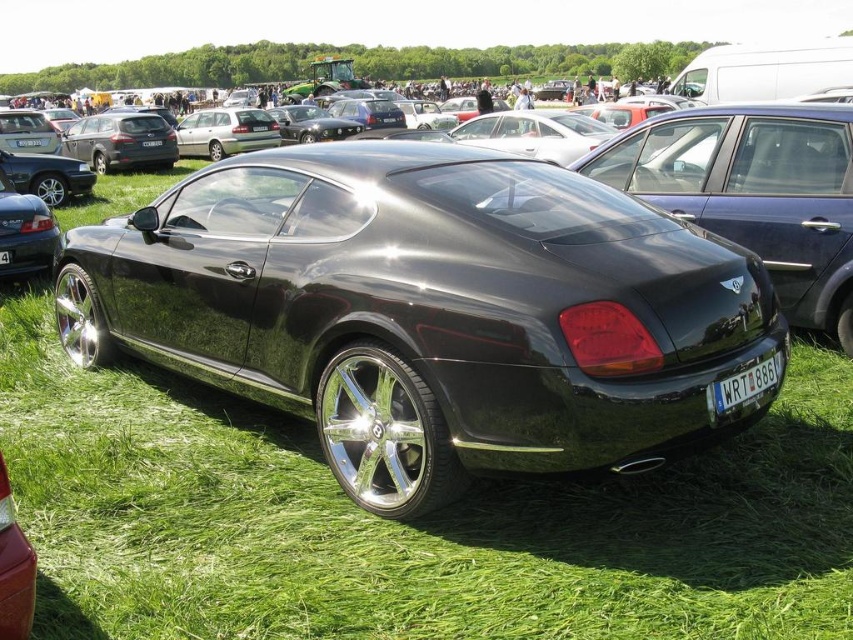
You are a photographer trying to capture the entire satin silver metallic station wagon at center and the white plastic license plate at center in one frame. Given that the license plate is smaller, will you need to adjust your camera angle to ensure both are fully visible?

The satin silver metallic station wagon at center is larger than the white plastic license plate at center, so you can position the camera to include both without needing to zoom in excessively. Ensure the license plate is within the frame while framing the entire station wagon.

You are a photographer at a car show. You want to take a photo of the shiny black car at center and the satin silver metallic station wagon at center. Which car should you focus on first if you want to capture both in the same frame without moving the camera?

The shiny black car at center is below the satin silver metallic station wagon at center, so you should focus on the satin silver metallic station wagon at center first to ensure both are in the frame without moving the camera.

You are standing in front of the shiny black car at center at an outdoor car show. You want to take a photo of yourself holding the car keys. You have a smartphone with a 12MP camera. The car keys are 15 cm long. To get the keys in focus, your phone needs to be at least 1.5 meters away from them. Can you step back enough to take this photo without moving the keys?

The shiny black car at center and viewer are 2.41 meters apart from each other. Since you need to be at least 1.5 meters away from the keys, and you are already 2.41 meters away from the car, you can comfortably take the photo without moving the keys.